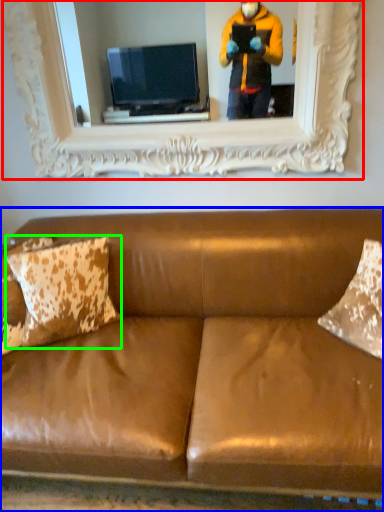
Question: Based on their relative distances, which object is nearer to picture frame (highlighted by a red box)? Choose from studio couch (highlighted by a blue box) and pillow (highlighted by a green box).

Choices:
 (A) studio couch
 (B) pillow

Answer: (B)